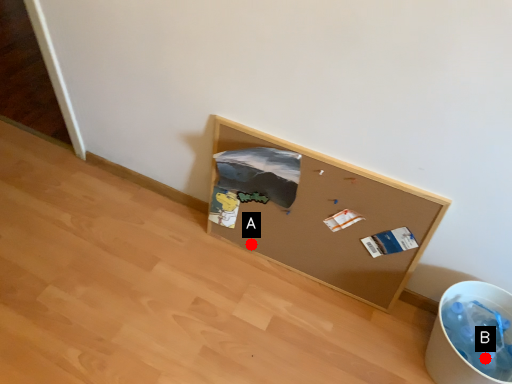
Question: Two points are circled on the image, labeled by A and B beside each circle. Which point is closer to the camera?

Choices:
 (A) A is closer
 (B) B is closer

Answer: (B)